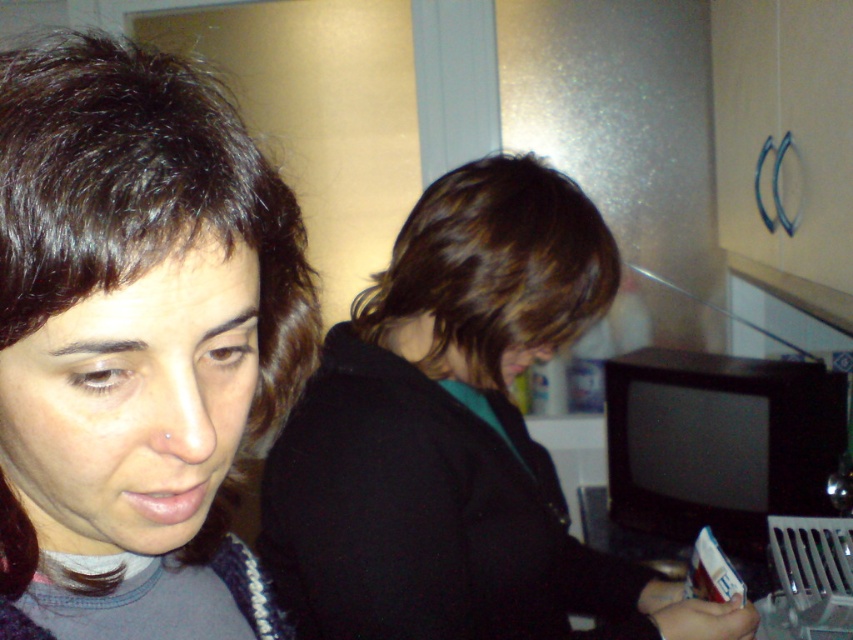
You are a delivery person who needs to place a small package between the dark brown hair at upper left and the dark brown hair at center. The package is 15 inches long. Will it fit in the space between them?

The distance between the dark brown hair at upper left and the dark brown hair at center is 17.56 inches. Since the package is 15 inches long, it will fit as there is enough space.